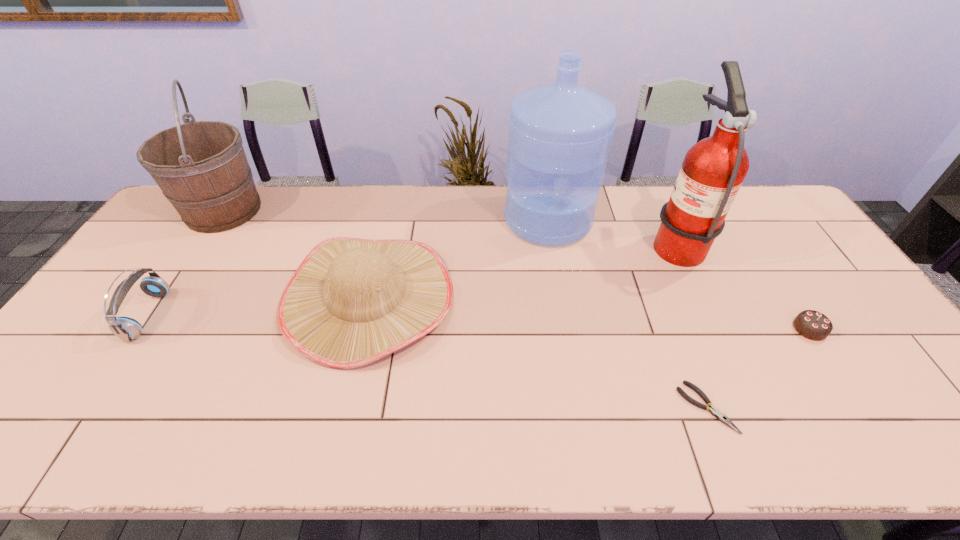
Find the location of `vacant region located 0.250m on the side of the fourth object from left to right with the handle`. vacant region located 0.250m on the side of the fourth object from left to right with the handle is located at coordinates (564, 312).

This screenshot has width=960, height=540. I want to click on vacant space located on the nozzle and handle of the fire extinguisher, so click(601, 242).

Locate an element on the screen. The width and height of the screenshot is (960, 540). blank area located on the nozzle and handle of the fire extinguisher is located at coordinates (544, 242).

This screenshot has height=540, width=960. What are the coordinates of `vacant space located 0.170m on the nozzle and handle of the fire extinguisher` in the screenshot? It's located at (594, 242).

Where is `blank space located on the front of the fifth shortest object`? blank space located on the front of the fifth shortest object is located at coordinates (188, 264).

The width and height of the screenshot is (960, 540). Identify the location of vacant space located on the left of the sunhat. (195, 297).

I want to click on free location located 0.300m on the ear cups of the headset, so click(271, 315).

The height and width of the screenshot is (540, 960). Identify the location of free location located 0.260m on the back of the chocolate cake. (759, 252).

You are a GUI agent. You are given a task and a screenshot of the screen. Output one action in this format:
    pyautogui.click(x=<x>, y=<y>)
    Task: Click on the free space located on the back of the shortest object
    The image size is (960, 540).
    Given the screenshot: What is the action you would take?
    pyautogui.click(x=665, y=300)

Locate an element on the screen. This screenshot has height=540, width=960. water jug present at the far edge is located at coordinates (560, 133).